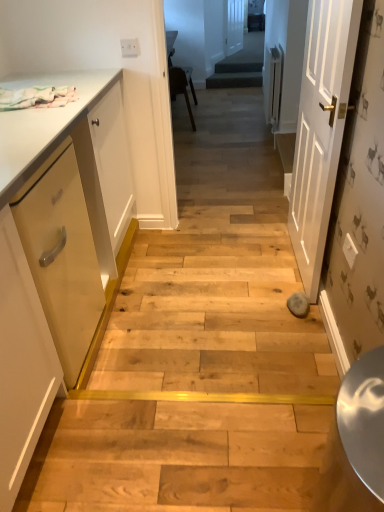
Question: Is matte white cabinet at left thinner than matte yellow drawer at left?

Choices:
 (A) yes
 (B) no

Answer: (B)

Question: Can you confirm if matte white cabinet at left is positioned to the left of matte yellow drawer at left?

Choices:
 (A) no
 (B) yes

Answer: (B)

Question: Does matte white cabinet at left come behind matte yellow drawer at left?

Choices:
 (A) no
 (B) yes

Answer: (A)

Question: Considering the relative sizes of matte white cabinet at left and matte yellow drawer at left in the image provided, is matte white cabinet at left wider than matte yellow drawer at left?

Choices:
 (A) yes
 (B) no

Answer: (A)

Question: Would you say matte white cabinet at left contains matte yellow drawer at left?

Choices:
 (A) yes
 (B) no

Answer: (A)

Question: From the image's perspective, is matte white cabinet at left located above matte yellow drawer at left?

Choices:
 (A) yes
 (B) no

Answer: (A)

Question: Is white painted wood door at center right, acting as the second door starting from the top, in contact with matte yellow drawer at left?

Choices:
 (A) no
 (B) yes

Answer: (A)

Question: From the image's perspective, is white painted wood door at center right, the 1th door viewed from the front, located above matte yellow drawer at left?

Choices:
 (A) no
 (B) yes

Answer: (B)

Question: Would you say white painted wood door at center right, placed as the second door when sorted from back to front, contains matte yellow drawer at left?

Choices:
 (A) no
 (B) yes

Answer: (A)

Question: Does white painted wood door at center right, acting as the second door starting from the top, have a lesser height compared to matte yellow drawer at left?

Choices:
 (A) no
 (B) yes

Answer: (A)

Question: From a real-world perspective, is white painted wood door at center right, acting as the second door starting from the top, beneath matte yellow drawer at left?

Choices:
 (A) no
 (B) yes

Answer: (A)

Question: From the image's perspective, is white painted wood door at center right, the 1th door viewed from the front, located beneath matte yellow drawer at left?

Choices:
 (A) no
 (B) yes

Answer: (A)

Question: From a real-world perspective, does dark green carpeted stairs at center stand above white painted wood door at center right, placed as the second door when sorted from back to front?

Choices:
 (A) no
 (B) yes

Answer: (A)